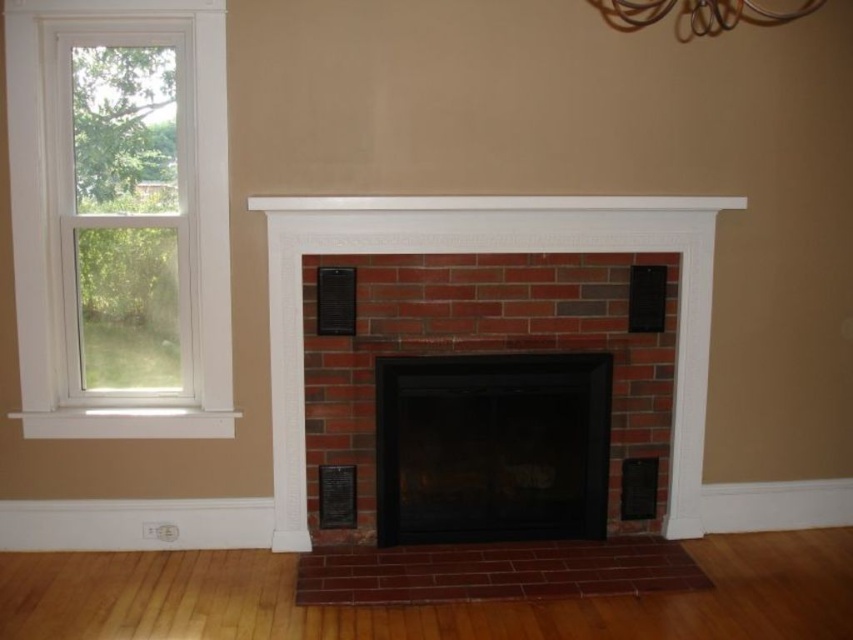
You are an interior designer planning to place a large sofa in front of the fireplace. The sofa is 2 meters wide. You see the red brick fireplace at center and the black glass fireplace at center. Which fireplace should you choose to place the sofa in front of to ensure it fits within the fireplace width?

The red brick fireplace at center has a greater width than the black glass fireplace at center. Therefore, placing the sofa in front of the red brick fireplace at center would ensure it fits within the fireplace width since it is wider.

You are an interior designer assessing the balance of elements in the room. Given the red brick fireplace at center and the white painted wood mantle at upper center, which object has a greater horizontal span?

The red brick fireplace at center has a greater horizontal span than the white painted wood mantle at upper center because its width surpasses the mantle.